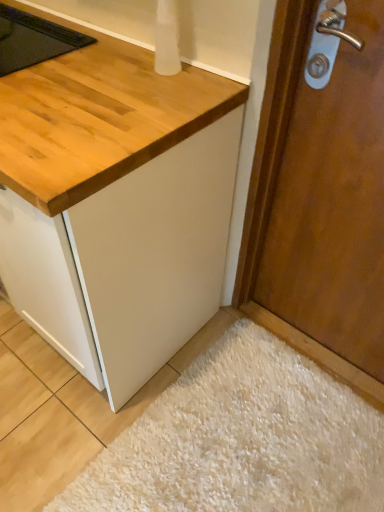
What do you see at coordinates (242, 440) in the screenshot?
I see `white shaggy rug at lower right` at bounding box center [242, 440].

This screenshot has width=384, height=512. I want to click on white shaggy rug at lower right, so click(242, 440).

What is the approximate height of white shaggy rug at lower right?

It is 1.45 inches.

Locate an element on the screen. This screenshot has height=512, width=384. wooden door at right is located at coordinates (334, 205).

Describe the element at coordinates (334, 205) in the screenshot. I see `wooden door at right` at that location.

Locate an element on the screen. The image size is (384, 512). white shaggy rug at lower right is located at coordinates [x=242, y=440].

Does white shaggy rug at lower right appear on the left side of wooden door at right?

Correct, you'll find white shaggy rug at lower right to the left of wooden door at right.

Which object is further away from the camera taking this photo, white shaggy rug at lower right or wooden door at right?

white shaggy rug at lower right is further away from the camera.

Is point (208, 464) more distant than point (349, 192)?

That is True.

From the image's perspective, is white shaggy rug at lower right under wooden door at right?

Correct, white shaggy rug at lower right appears lower than wooden door at right in the image.

From a real-world perspective, is white shaggy rug at lower right on wooden door at right?

No, from a real-world perspective, white shaggy rug at lower right is not above wooden door at right.

Is white shaggy rug at lower right wider or thinner than wooden door at right?

white shaggy rug at lower right is wider than wooden door at right.

Can you confirm if white shaggy rug at lower right is taller than wooden door at right?

No.

Considering the sizes of white shaggy rug at lower right and wooden door at right in the image, is white shaggy rug at lower right bigger or smaller than wooden door at right?

In the image, white shaggy rug at lower right appears to be smaller than wooden door at right.

In the scene shown: Is white shaggy rug at lower right located outside wooden door at right?

Indeed, white shaggy rug at lower right is completely outside wooden door at right.

Is white shaggy rug at lower right beside wooden door at right?

No, white shaggy rug at lower right is not next to wooden door at right.

Is white shaggy rug at lower right facing away from wooden door at right?

No, white shaggy rug at lower right is not facing the opposite direction of wooden door at right.

How different are the orientations of white shaggy rug at lower right and wooden door at right in degrees?

white shaggy rug at lower right and wooden door at right are facing 93.4 degrees away from each other.

How distant is white shaggy rug at lower right from wooden door at right?

white shaggy rug at lower right is 20.44 inches away from wooden door at right.

Where is `plain on the left of wooden door at right`? The height and width of the screenshot is (512, 384). plain on the left of wooden door at right is located at coordinates (242, 440).

In the image, is wooden door at right on the left side or the right side of white shaggy rug at lower right?

wooden door at right is positioned on white shaggy rug at lower right's right side.

From the picture: Considering their positions, is wooden door at right located in front of or behind white shaggy rug at lower right?

In the image, wooden door at right appears in front of white shaggy rug at lower right.

Considering the points (370, 230) and (285, 474), which point is behind, point (370, 230) or point (285, 474)?

Point (285, 474)

From the image's perspective, is wooden door at right positioned above or below white shaggy rug at lower right?

wooden door at right is above white shaggy rug at lower right.

From a real-world perspective, relative to white shaggy rug at lower right, is wooden door at right vertically above or below?

wooden door at right is above white shaggy rug at lower right.

Looking at this image, between wooden door at right and white shaggy rug at lower right, which one has larger width?

With larger width is white shaggy rug at lower right.

Does wooden door at right have a greater height compared to white shaggy rug at lower right?

Yes, wooden door at right is taller than white shaggy rug at lower right.

Is wooden door at right smaller than white shaggy rug at lower right?

Incorrect, wooden door at right is not smaller in size than white shaggy rug at lower right.

Looking at this image, would you say wooden door at right is outside white shaggy rug at lower right?

wooden door at right lies outside white shaggy rug at lower right's area.

Is wooden door at right far away from white shaggy rug at lower right?

No, wooden door at right is not far away from white shaggy rug at lower right.

Is wooden door at right facing towards white shaggy rug at lower right?

Yes, wooden door at right is turned towards white shaggy rug at lower right.

What's the angular difference between wooden door at right and white shaggy rug at lower right's facing directions?

The facing directions of wooden door at right and white shaggy rug at lower right are 93.4 degrees apart.

This screenshot has width=384, height=512. What are the coordinates of `plain beneath the wooden door at right (from a real-world perspective)` in the screenshot? It's located at (242, 440).

Locate an element on the screen. plain behind the wooden door at right is located at coordinates coord(242,440).

Image resolution: width=384 pixels, height=512 pixels. Find the location of `door on the right side of white shaggy rug at lower right`. door on the right side of white shaggy rug at lower right is located at coordinates (334, 205).